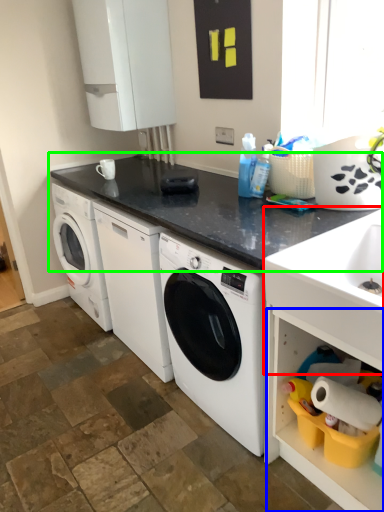
Question: Which object is the farthest from sink (highlighted by a red box)? Choose among these: shelf (highlighted by a blue box) or countertop (highlighted by a green box).

Choices:
 (A) shelf
 (B) countertop

Answer: (B)